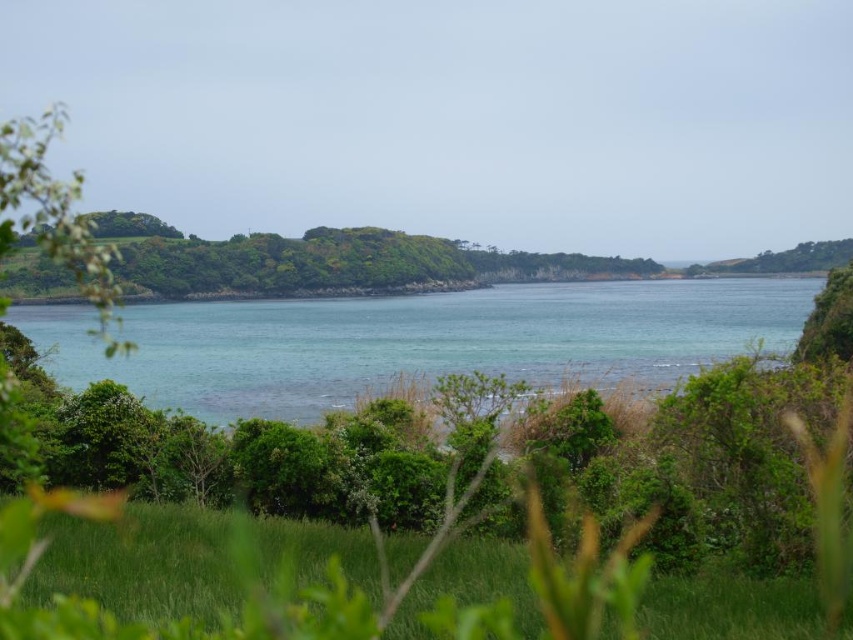
You are standing at the shoreline and want to take a photo of the clear blue water at center and the green grassy at lower center. Which object will appear closer to you in the photo?

The clear blue water at center will appear closer to you in the photo because it is positioned further to the viewer than the green grassy at lower center.

You are standing at the center of the image and want to walk towards the clear blue water at center. In which direction should you move relative to your current position?

You should move directly forward since the clear blue water at center is located at the center point of the image, which is directly in front of you.